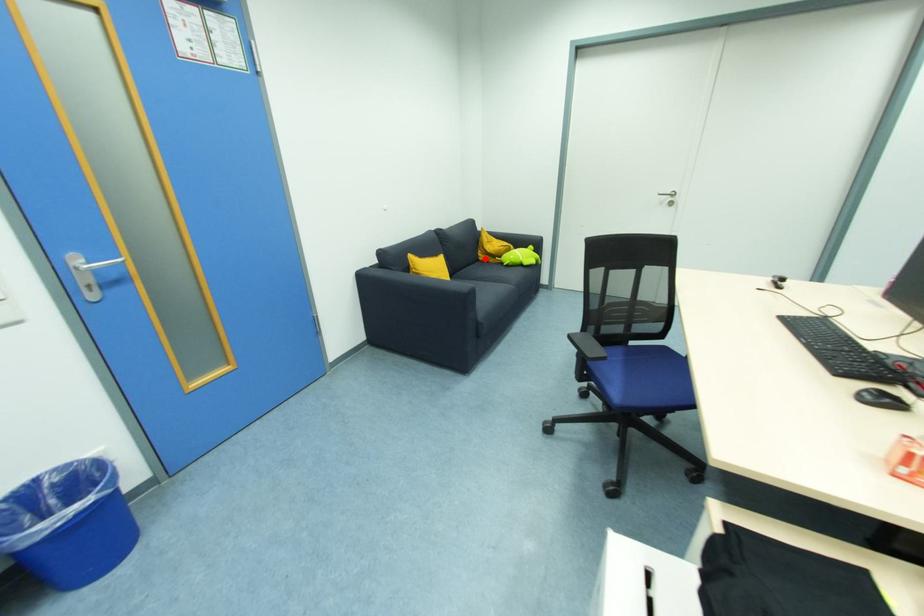
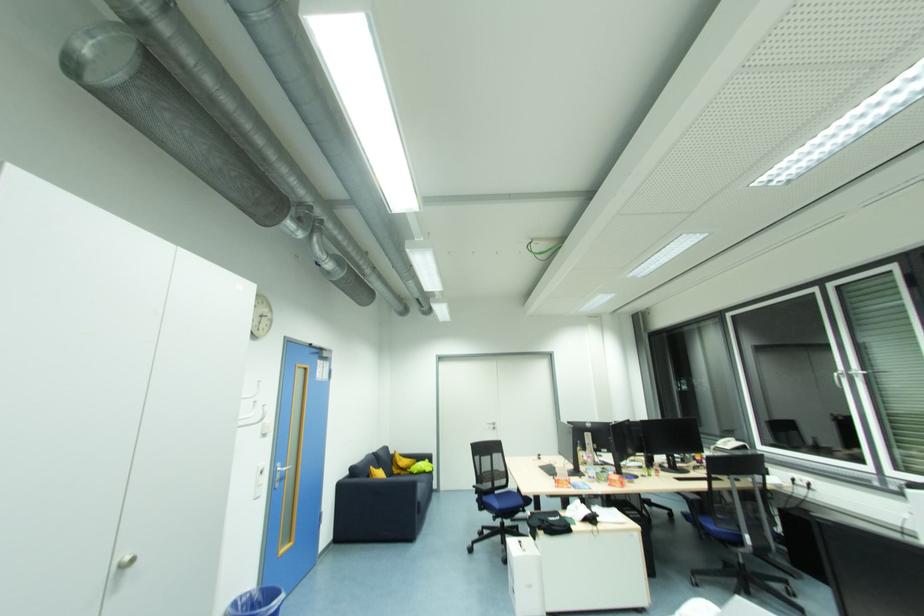
Question: I am providing you with two images of the same scene from different viewpoints. Image1 has a red point marked. In image2, the corresponding 3D location appears at what relative position? Reply with the corresponding letter.

Choices:
 (A) Closer
 (B) Farther

Answer: (B)